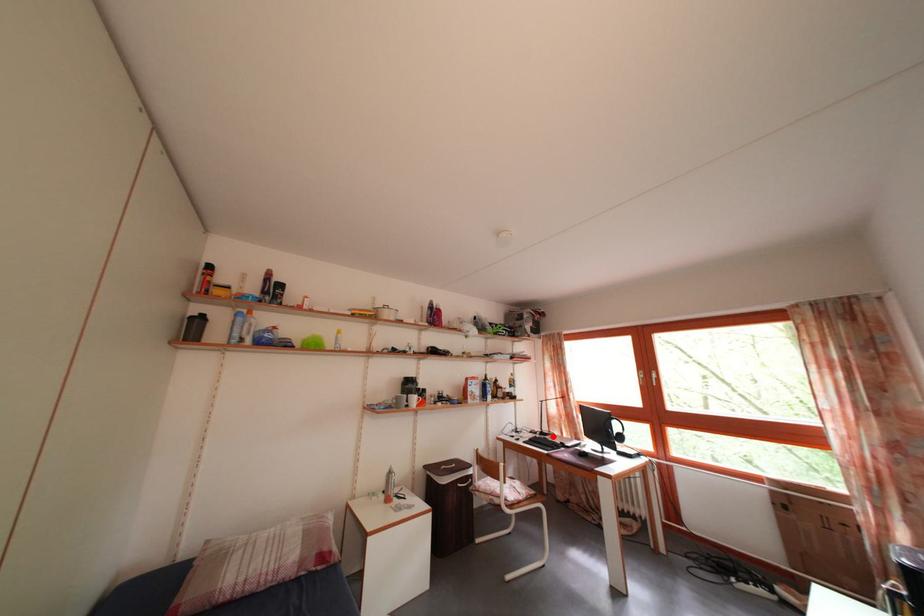
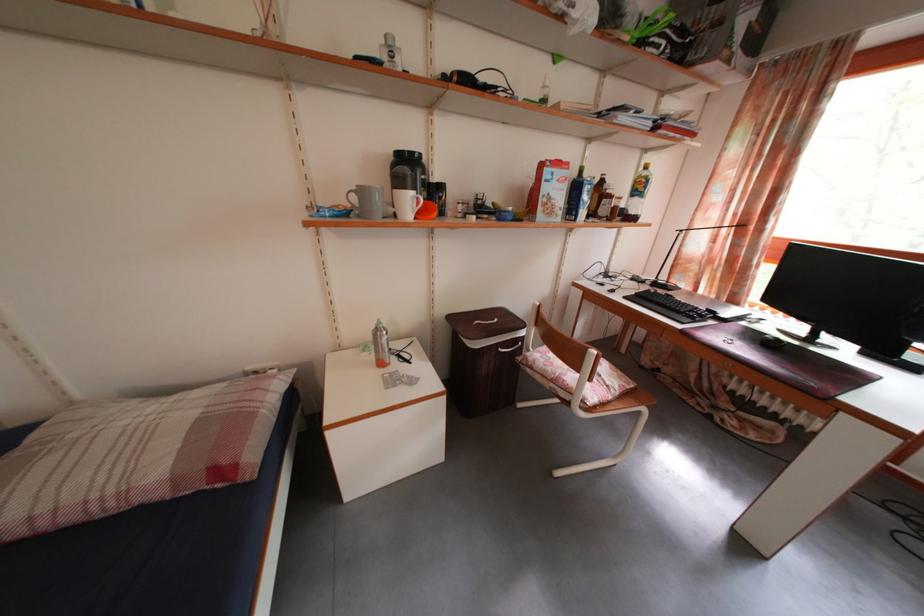
The point at the highlighted location is marked in the first image. Where is the corresponding point in the second image?

(671, 285)